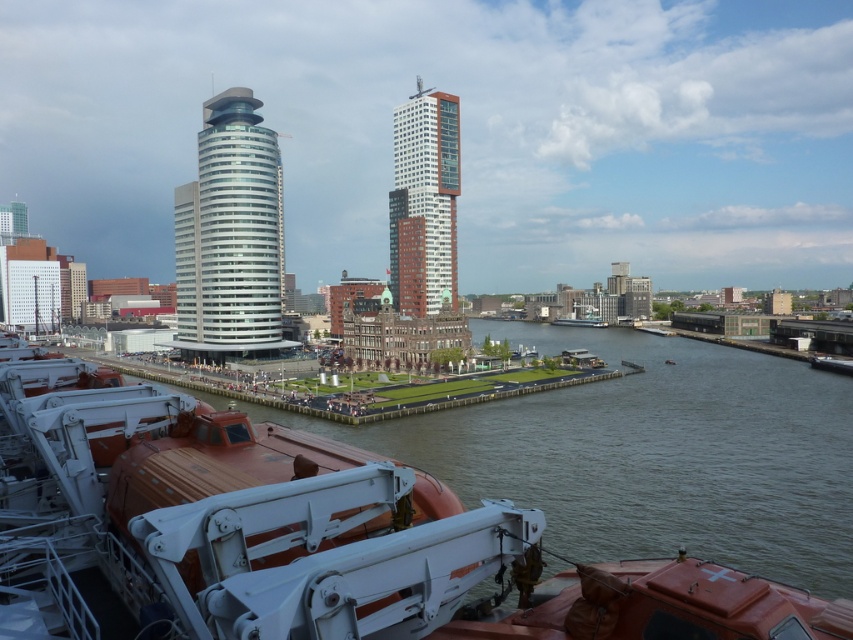
Who is shorter, orange rubber lifeboat at lower left or white glass tower at center?

orange rubber lifeboat at lower left

Between orange rubber lifeboat at lower left and white glass tower at center, which one is positioned lower?

orange rubber lifeboat at lower left

You are a GUI agent. You are given a task and a screenshot of the screen. Output one action in this format:
    pyautogui.click(x=<x>, y=<y>)
    Task: Click on the orange rubber lifeboat at lower left
    
    Given the screenshot: What is the action you would take?
    click(x=236, y=529)

Which is behind, point (241, 268) or point (390, 230)?

The point (390, 230) is more distant.

Who is more distant from viewer, (234, 280) or (434, 259)?

Point (434, 259)

Identify the location of white glass tower at center. This screenshot has height=640, width=853. (230, 236).

Between orange rubber lifeboat at lower left and red brick building at center, which one has more height?

red brick building at center is taller.

Is orange rubber lifeboat at lower left closer to camera compared to red brick building at center?

Yes.

Locate an element on the screen. The height and width of the screenshot is (640, 853). orange rubber lifeboat at lower left is located at coordinates (236, 529).

This screenshot has width=853, height=640. In order to click on orange rubber lifeboat at lower left in this screenshot , I will do `click(236, 529)`.